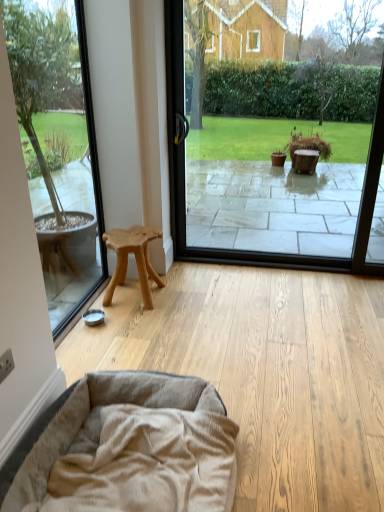
What do you see at coordinates (135, 259) in the screenshot? I see `natural wood stool at left` at bounding box center [135, 259].

Find the location of a particular element. natural wood stool at left is located at coordinates (135, 259).

What do you see at coordinates (58, 148) in the screenshot? Image resolution: width=384 pixels, height=512 pixels. I see `transparent glass window at left, positioned as the 1th window screen in left-to-right order` at bounding box center [58, 148].

Measure the distance between point (55, 109) and camera.

9.41 feet.

The image size is (384, 512). What are the coordinates of `natural wood stool at left` in the screenshot? It's located at (135, 259).

Based on the photo, from a real-world perspective, which object stands above the other?

From a 3D spatial view, transparent glass window at center, which is counted as the first window screen, starting from the right, is above.

Considering the relative sizes of transparent glass window at left, positioned as the 1th window screen in left-to-right order, and transparent glass window at center, which is the second window screen in left-to-right order, in the image provided, is transparent glass window at left, positioned as the 1th window screen in left-to-right order, wider than transparent glass window at center, which is the second window screen in left-to-right order,?

No, transparent glass window at left, positioned as the 1th window screen in left-to-right order, is not wider than transparent glass window at center, which is the second window screen in left-to-right order.

Is transparent glass window at center, which is counted as the first window screen, starting from the right, a part of transparent glass window at left, which is the 2th window screen in right-to-left order?

No, transparent glass window at left, which is the 2th window screen in right-to-left order, does not contain transparent glass window at center, which is counted as the first window screen, starting from the right.

How many degrees apart are the facing directions of transparent glass window at left, positioned as the 1th window screen in left-to-right order, and transparent glass window at center, which is the second window screen in left-to-right order?

They differ by 89.7 degrees in their facing directions.

Which is correct: transparent glass window at center, which is counted as the first window screen, starting from the right, is inside beige plush dog bed at lower left, or outside of it?

transparent glass window at center, which is counted as the first window screen, starting from the right, cannot be found inside beige plush dog bed at lower left.

Who is shorter, transparent glass window at center, which is counted as the first window screen, starting from the right, or beige plush dog bed at lower left?

beige plush dog bed at lower left.

From the picture: Is transparent glass window at center, which is the second window screen in left-to-right order, aimed at beige plush dog bed at lower left?

Yes, transparent glass window at center, which is the second window screen in left-to-right order, is oriented towards beige plush dog bed at lower left.

Considering the sizes of objects transparent glass window at center, which is counted as the first window screen, starting from the right, and beige plush dog bed at lower left in the image provided, who is smaller, transparent glass window at center, which is counted as the first window screen, starting from the right, or beige plush dog bed at lower left?

Smaller between the two is beige plush dog bed at lower left.

From their relative heights in the image, would you say transparent glass window at left, which is the 2th window screen in right-to-left order, is taller or shorter than beige plush dog bed at lower left?

In the image, transparent glass window at left, which is the 2th window screen in right-to-left order, appears to be taller than beige plush dog bed at lower left.

Is transparent glass window at left, which is the 2th window screen in right-to-left order, turned away from beige plush dog bed at lower left?

No, beige plush dog bed at lower left is not at the back of transparent glass window at left, which is the 2th window screen in right-to-left order.

Is transparent glass window at left, which is the 2th window screen in right-to-left order, surrounding beige plush dog bed at lower left?

No, beige plush dog bed at lower left is not surrounded by transparent glass window at left, which is the 2th window screen in right-to-left order.

Locate an element on the screen. The width and height of the screenshot is (384, 512). window screen that appears on the left of beige plush dog bed at lower left is located at coordinates (58, 148).

From a real-world perspective, which object rests below the other?

From a 3D spatial view, natural wood stool at left is below.

Considering the positions of points (148, 290) and (247, 162), is point (148, 290) closer to camera compared to point (247, 162)?

Yes.

Based on their sizes in the image, would you say natural wood stool at left is bigger or smaller than transparent glass window at center, which is the second window screen in left-to-right order?

Clearly, natural wood stool at left is smaller in size than transparent glass window at center, which is the second window screen in left-to-right order.

Is transparent glass window at left, positioned as the 1th window screen in left-to-right order, in contact with natural wood stool at left?

No, transparent glass window at left, positioned as the 1th window screen in left-to-right order, is not beside natural wood stool at left.

Is transparent glass window at left, which is the 2th window screen in right-to-left order, bigger than natural wood stool at left?

No.

Find the location of a particular element. The width and height of the screenshot is (384, 512). stool on the right of transparent glass window at left, positioned as the 1th window screen in left-to-right order is located at coordinates (135, 259).

From the image's perspective, which is above, transparent glass window at left, positioned as the 1th window screen in left-to-right order, or natural wood stool at left?

From the image's view, transparent glass window at left, positioned as the 1th window screen in left-to-right order, is above.

Is beige plush dog bed at lower left outside of natural wood stool at left?

Yes, beige plush dog bed at lower left is located beyond the bounds of natural wood stool at left.

From a real-world perspective, which object stands above the other?

From a 3D spatial view, natural wood stool at left is above.

Is point (6, 499) closer to viewer compared to point (147, 238)?

Yes, it is in front of point (147, 238).

Between beige plush dog bed at lower left and natural wood stool at left, which one has larger size?

With larger size is beige plush dog bed at lower left.

Would you say transparent glass window at center, which is counted as the first window screen, starting from the right, is inside or outside transparent glass window at left, which is the 2th window screen in right-to-left order?

transparent glass window at center, which is counted as the first window screen, starting from the right, is outside transparent glass window at left, which is the 2th window screen in right-to-left order.

From a real-world perspective, does transparent glass window at center, which is counted as the first window screen, starting from the right, sit lower than transparent glass window at left, positioned as the 1th window screen in left-to-right order?

Actually, transparent glass window at center, which is counted as the first window screen, starting from the right, is physically above transparent glass window at left, positioned as the 1th window screen in left-to-right order, in the real world.

Is point (339, 200) in front of point (75, 232)?

No, it is not.

You are a GUI agent. You are given a task and a screenshot of the screen. Output one action in this format:
    pyautogui.click(x=<x>, y=<y>)
    Task: Click on the window screen on the left of transparent glass window at center, which is counted as the first window screen, starting from the right
    Image resolution: width=384 pixels, height=512 pixels.
    Given the screenshot: What is the action you would take?
    pyautogui.click(x=58, y=148)

From the image's perspective, count 2nd window screens upward from the beige plush dog bed at lower left and point to it. Please provide its 2D coordinates.

[(280, 149)]

Considering their positions, is beige plush dog bed at lower left positioned further to transparent glass window at center, which is the second window screen in left-to-right order, than transparent glass window at left, positioned as the 1th window screen in left-to-right order?

Based on the image, beige plush dog bed at lower left appears to be further to transparent glass window at center, which is the second window screen in left-to-right order.

Considering their positions, is transparent glass window at left, which is the 2th window screen in right-to-left order, positioned further to transparent glass window at center, which is the second window screen in left-to-right order, than natural wood stool at left?

Among the two, natural wood stool at left is located further to transparent glass window at center, which is the second window screen in left-to-right order.

Which object lies nearer to the anchor point transparent glass window at center, which is counted as the first window screen, starting from the right, transparent glass window at left, positioned as the 1th window screen in left-to-right order, or beige plush dog bed at lower left?

transparent glass window at left, positioned as the 1th window screen in left-to-right order, lies closer to transparent glass window at center, which is counted as the first window screen, starting from the right, than the other object.

Looking at the image, which one is located closer to beige plush dog bed at lower left, transparent glass window at center, which is counted as the first window screen, starting from the right, or transparent glass window at left, positioned as the 1th window screen in left-to-right order?

transparent glass window at left, positioned as the 1th window screen in left-to-right order, lies closer to beige plush dog bed at lower left than the other object.

Estimate the real-world distances between objects in this image. Which object is further from natural wood stool at left, beige plush dog bed at lower left or transparent glass window at center, which is counted as the first window screen, starting from the right?

Based on the image, transparent glass window at center, which is counted as the first window screen, starting from the right, appears to be further to natural wood stool at left.

When comparing their distances from transparent glass window at left, positioned as the 1th window screen in left-to-right order, does transparent glass window at center, which is counted as the first window screen, starting from the right, or natural wood stool at left seem closer?

natural wood stool at left.

Which object lies further to the anchor point transparent glass window at left, positioned as the 1th window screen in left-to-right order, natural wood stool at left or transparent glass window at center, which is the second window screen in left-to-right order?

The object further to transparent glass window at left, positioned as the 1th window screen in left-to-right order, is transparent glass window at center, which is the second window screen in left-to-right order.

Based on their spatial positions, is natural wood stool at left or beige plush dog bed at lower left further from transparent glass window at left, positioned as the 1th window screen in left-to-right order?

Based on the image, beige plush dog bed at lower left appears to be further to transparent glass window at left, positioned as the 1th window screen in left-to-right order.

Where is `window screen that lies between transparent glass window at center, which is the second window screen in left-to-right order, and beige plush dog bed at lower left from top to bottom`? This screenshot has height=512, width=384. window screen that lies between transparent glass window at center, which is the second window screen in left-to-right order, and beige plush dog bed at lower left from top to bottom is located at coordinates tap(58, 148).

In order to click on stool between transparent glass window at left, which is the 2th window screen in right-to-left order, and transparent glass window at center, which is the second window screen in left-to-right order, in the horizontal direction in this screenshot , I will do `click(135, 259)`.

At what (x,y) coordinates should I click in order to perform the action: click on stool between transparent glass window at center, which is the second window screen in left-to-right order, and beige plush dog bed at lower left vertically. Please return your answer as a coordinate pair (x, y). Looking at the image, I should click on click(135, 259).